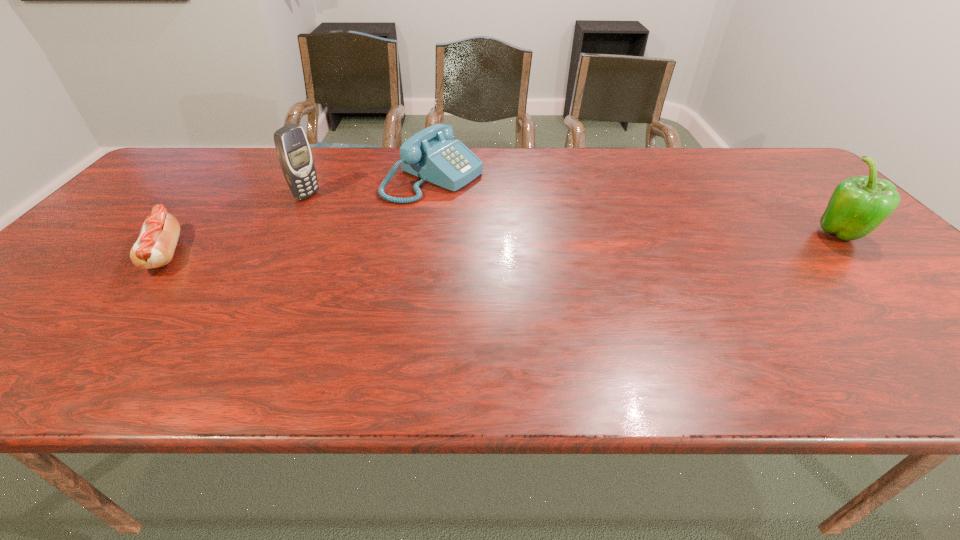
Locate an element on the screen. free spot between the third object from left to right and the bell pepper is located at coordinates [x=637, y=207].

In order to click on empty space between the bell pepper and the shortest object in this screenshot , I will do `click(503, 245)`.

Where is `object that stands as the third closest to the sausage`? This screenshot has height=540, width=960. object that stands as the third closest to the sausage is located at coordinates (858, 205).

Image resolution: width=960 pixels, height=540 pixels. What are the coordinates of `the closest object relative to the cellular telephone` in the screenshot? It's located at (431, 154).

You are a GUI agent. You are given a task and a screenshot of the screen. Output one action in this format:
    pyautogui.click(x=<x>, y=<y>)
    Task: Click on the vacant area in the image that satisfies the following two spatial constraints: 1. on the back side of the shortest object; 2. on the left side of the rightmost object
    Image resolution: width=960 pixels, height=540 pixels.
    Given the screenshot: What is the action you would take?
    pyautogui.click(x=180, y=236)

Find the location of a particular element. This screenshot has height=540, width=960. vacant space that satisfies the following two spatial constraints: 1. on the back side of the leftmost object; 2. on the left side of the rightmost object is located at coordinates (180, 236).